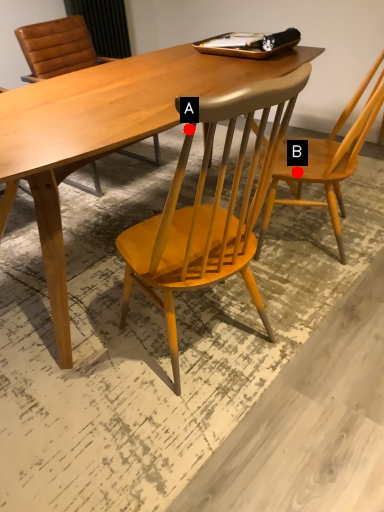
Question: Two points are circled on the image, labeled by A and B beside each circle. Which point is farther from the camera taking this photo?

Choices:
 (A) A is further
 (B) B is further

Answer: (B)